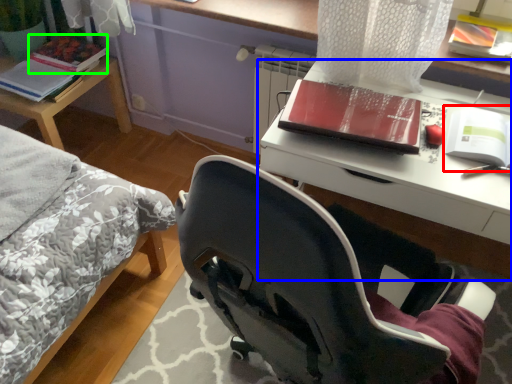
Question: Based on their relative distances, which object is nearer to paperback book (highlighted by a red box)? Choose from desk (highlighted by a blue box) and paperback book (highlighted by a green box).

Choices:
 (A) desk
 (B) paperback book

Answer: (A)